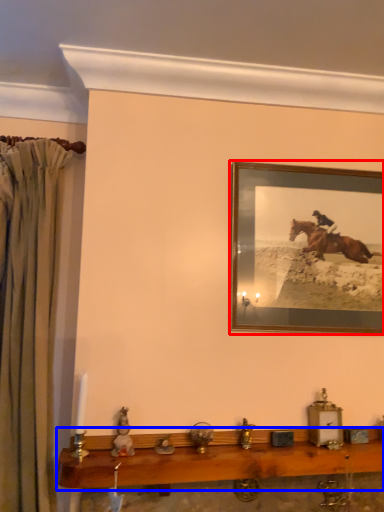
Question: Which point is further to the camera, picture frame (highlighted by a red box) or table (highlighted by a blue box)?

Choices:
 (A) picture frame
 (B) table

Answer: (A)